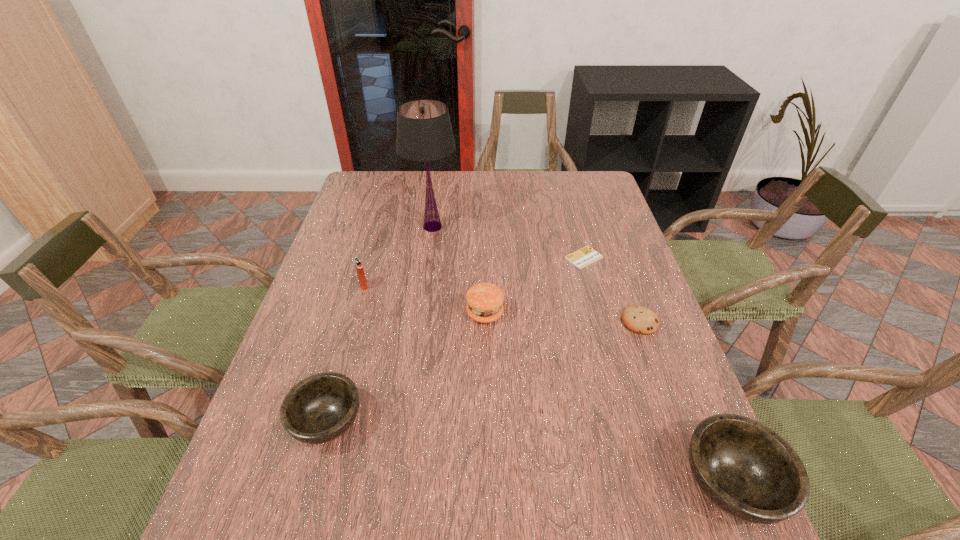
Where is `cookie positioned at the right edge`? This screenshot has height=540, width=960. cookie positioned at the right edge is located at coordinates (638, 319).

This screenshot has width=960, height=540. I want to click on object present at the near left corner, so click(320, 408).

At what (x,y) coordinates should I click in order to perform the action: click on object present at the near right corner. Please return your answer as a coordinate pair (x, y). Looking at the image, I should click on (746, 469).

Where is `free space at the far edge`? Image resolution: width=960 pixels, height=540 pixels. free space at the far edge is located at coordinates (545, 172).

In order to click on vacant space at the near edge of the desktop in this screenshot , I will do `click(529, 464)`.

You are a GUI agent. You are given a task and a screenshot of the screen. Output one action in this format:
    pyautogui.click(x=<x>, y=<y>)
    Task: Click on the vacant space at the left edge of the desktop
    The image size is (960, 540).
    Given the screenshot: What is the action you would take?
    pyautogui.click(x=377, y=258)

Where is `free location at the right edge of the desktop`? This screenshot has width=960, height=540. free location at the right edge of the desktop is located at coordinates (608, 339).

Where is `free space at the far right corner`? Image resolution: width=960 pixels, height=540 pixels. free space at the far right corner is located at coordinates (571, 183).

Where is `free space between the fifth object from right to left and the cookie`? free space between the fifth object from right to left and the cookie is located at coordinates (537, 274).

The image size is (960, 540). Find the location of `empty space that is in between the fourth object from right to left and the taller bowl`. empty space that is in between the fourth object from right to left and the taller bowl is located at coordinates pyautogui.click(x=608, y=398).